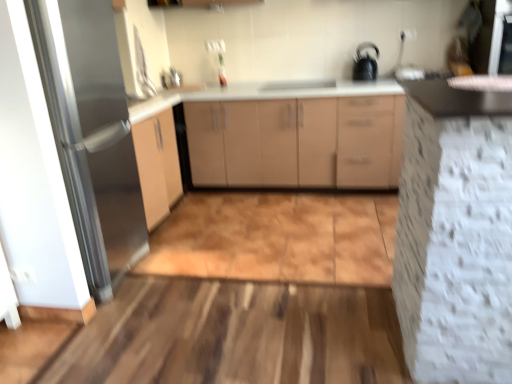
Question: Looking at the image, does satin silver fridge at left seem bigger or smaller compared to white textured cabinet at right, the 1th cabinetry from the front?

Choices:
 (A) small
 (B) big

Answer: (A)

Question: Is point (117, 64) closer or farther from the camera than point (428, 259)?

Choices:
 (A) closer
 (B) farther

Answer: (B)

Question: Which of these objects is positioned closest to the white textured cabinet at right, which is the second cabinetry in back-to-front order?

Choices:
 (A) satin nickel faucet at upper center
 (B) matte beige cabinet at center, the 1th cabinetry when ordered from back to front
 (C) satin silver fridge at left
 (D) black glossy kettle at upper right

Answer: (C)

Question: Based on their relative distances, which object is farther from the black glossy kettle at upper right?

Choices:
 (A) satin silver fridge at left
 (B) satin nickel faucet at upper center
 (C) white textured cabinet at right, the 1th cabinetry from the front
 (D) matte beige cabinet at center, positioned as the second cabinetry in front-to-back order

Answer: (A)